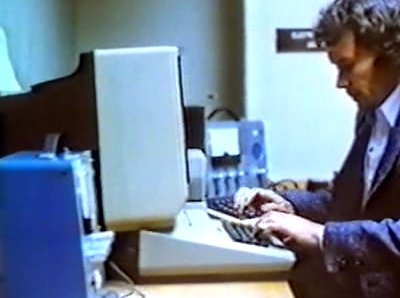
Where is `keyboard`? This screenshot has width=400, height=298. keyboard is located at coordinates (244, 231), (228, 207).